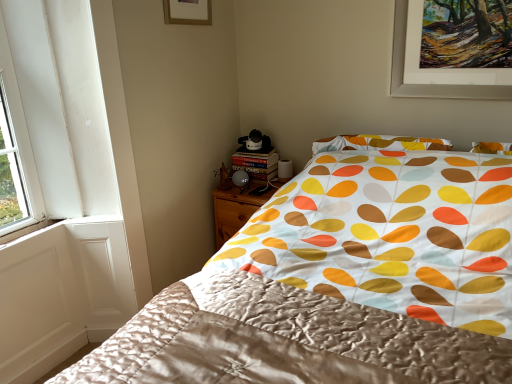
Question: Would you say matte gold picture frame at upper center is to the left or to the right of silky fabric bed at center in the picture?

Choices:
 (A) right
 (B) left

Answer: (B)

Question: Is matte gold picture frame at upper center in front of or behind silky fabric bed at center in the image?

Choices:
 (A) front
 (B) behind

Answer: (B)

Question: Which object is positioned closest to the silky fabric bed at center?

Choices:
 (A) matte gold picture frame at upper center
 (B) wooden nightstand at lower center
 (C) silky satin blanket at center

Answer: (C)

Question: Estimate the real-world distances between objects in this image. Which object is farther from the silky fabric bed at center?

Choices:
 (A) matte gold picture frame at upper center
 (B) silky satin blanket at center
 (C) wooden nightstand at lower center

Answer: (A)